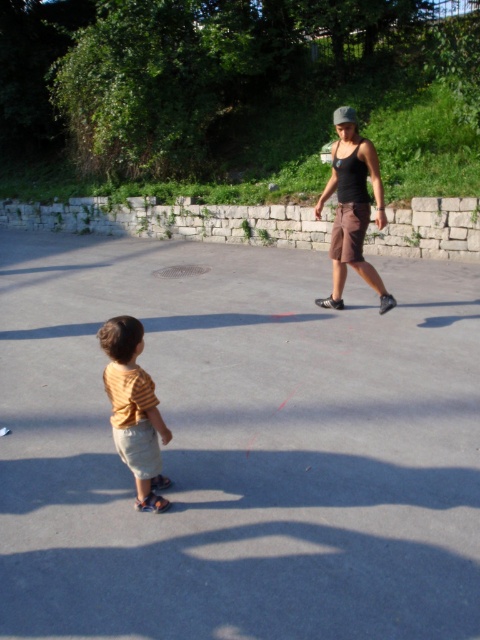
You are standing at the point marked by coordinates point [133,410]. Looking towards the direction of the yellow striped shirt at left, which direction should you walk to reach the adult in brown shorts walking away from the camera?

The adult in brown shorts walking away from the camera is to the right of the yellow striped shirt at left. So you should walk towards the right direction to reach them.

Based on the scene description, which object is smaller in size between the yellow striped shirt at left and the black matte tank top at center?

The yellow striped shirt at left is smaller than the black matte tank top at center.